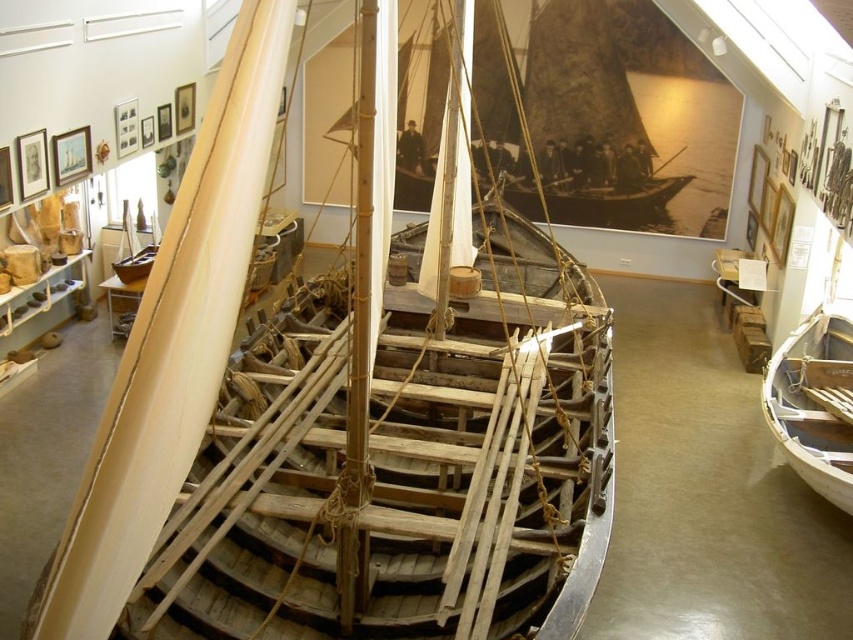
Between wooden boat at center and white wood boat at lower right, which one appears on the left side from the viewer's perspective?

wooden boat at center

Is point (589, 468) closer to viewer compared to point (833, 413)?

Yes.

Who is more distant from viewer, (293, 496) or (817, 444)?

Point (817, 444)

This screenshot has height=640, width=853. What are the coordinates of `wooden boat at center` in the screenshot? It's located at (404, 460).

Does wooden sailboat at upper center appear on the right side of white wood boat at lower right?

Incorrect, wooden sailboat at upper center is not on the right side of white wood boat at lower right.

Who is taller, wooden sailboat at upper center or white wood boat at lower right?

Standing taller between the two is white wood boat at lower right.

Where is `wooden sailboat at upper center`? The image size is (853, 640). wooden sailboat at upper center is located at coordinates (599, 115).

Does wooden boat at center have a larger size compared to wooden sailboat at upper center?

Correct, wooden boat at center is larger in size than wooden sailboat at upper center.

Does point (256, 512) come behind point (548, 20)?

No.

Identify the location of wooden boat at center. The width and height of the screenshot is (853, 640). (404, 460).